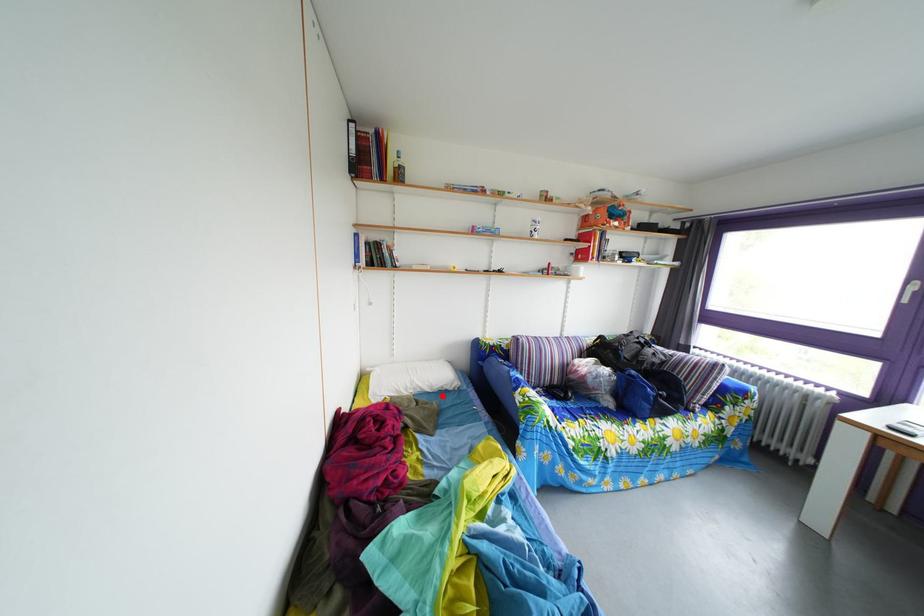
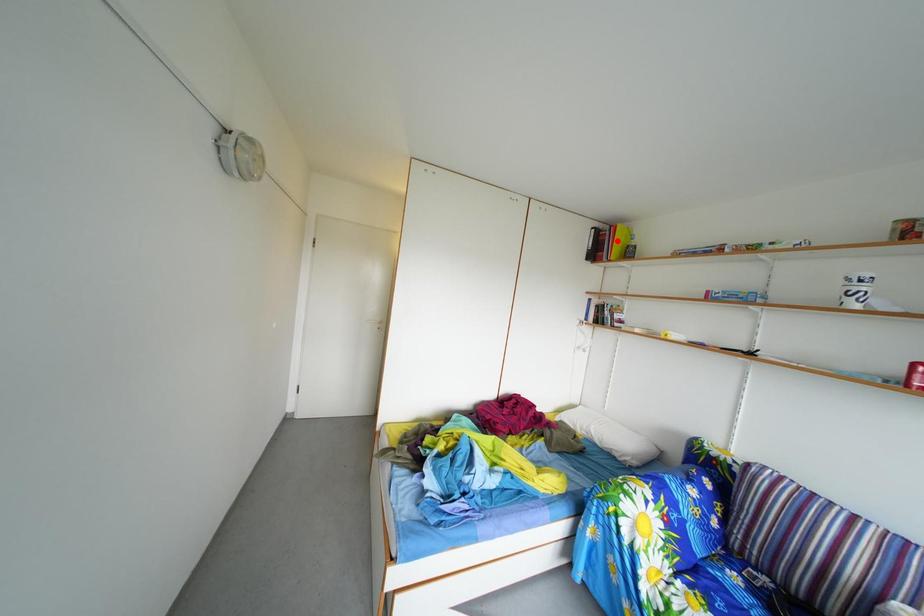
I am providing you with two images of the same scene from different viewpoints. A red point is marked on the first image and another point is marked on the second image. Is the marked point in image1 the same physical position as the marked point in image2?

No